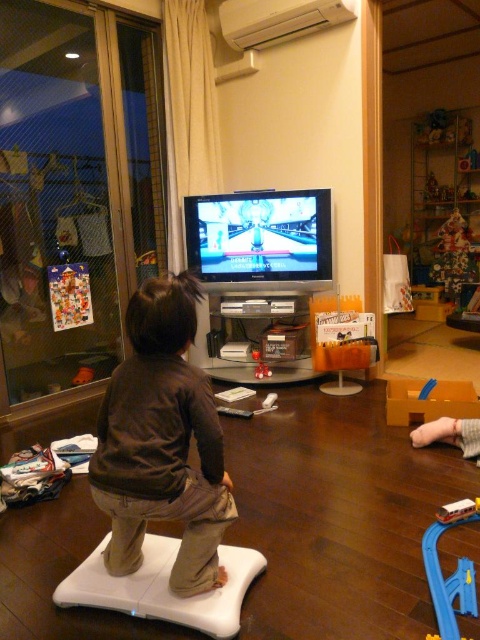
You are a parent trying to ensure your child stays within a safe distance from the TV. You see the brown cotton toddler at center and the shiny plastic tv at center. Which object is closer to the left side of the room?

The brown cotton toddler at center is positioned on the left side of the shiny plastic tv at center, meaning it is closer to the left side of the room.

You are a delivery person who needs to place a new smooth plastic train at center on the existing shiny plastic tv at center. Can the train fit on the TV without hanging over the edges?

The shiny plastic tv at center might be wider than smooth plastic train at center, so there is a possibility that the train can fit, but it depends on the exact dimensions. Further measurement is needed to confirm.